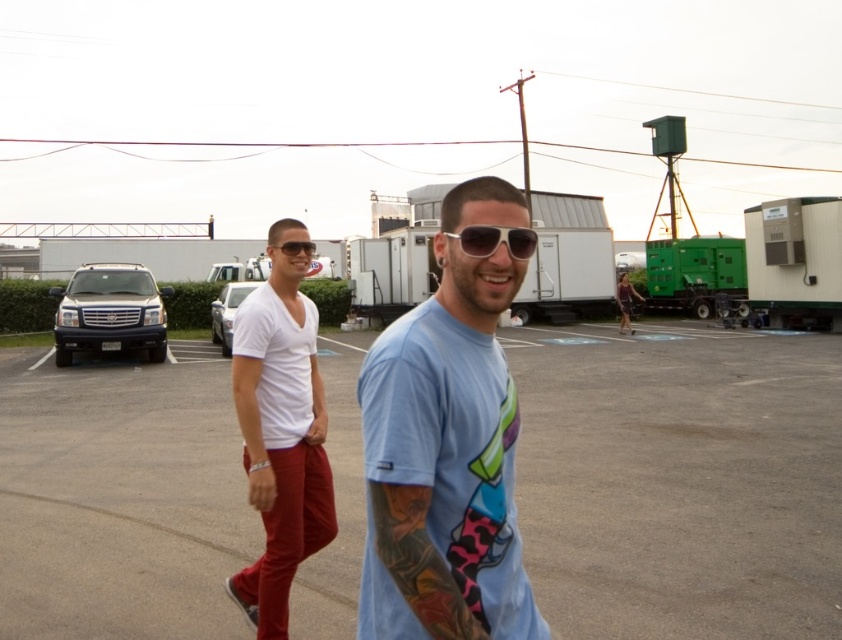
Is light blue t-shirt at center to the right of shiny black suv at left from the viewer's perspective?

Correct, you'll find light blue t-shirt at center to the right of shiny black suv at left.

Where is `light blue t-shirt at center`? The width and height of the screenshot is (842, 640). light blue t-shirt at center is located at coordinates (446, 449).

The image size is (842, 640). Find the location of `light blue t-shirt at center`. light blue t-shirt at center is located at coordinates 446,449.

Can you confirm if gray asphalt parking lot at center is positioned to the left of white matte shirt at center?

In fact, gray asphalt parking lot at center is to the right of white matte shirt at center.

Is gray asphalt parking lot at center closer to camera compared to white matte shirt at center?

No.

Is point (725, 454) farther from camera compared to point (300, 444)?

Yes, point (725, 454) is behind point (300, 444).

Where is `gray asphalt parking lot at center`? This screenshot has width=842, height=640. gray asphalt parking lot at center is located at coordinates (680, 481).

Is point (129, 337) behind point (499, 227)?

That is True.

Locate an element on the screen. shiny black suv at left is located at coordinates (109, 310).